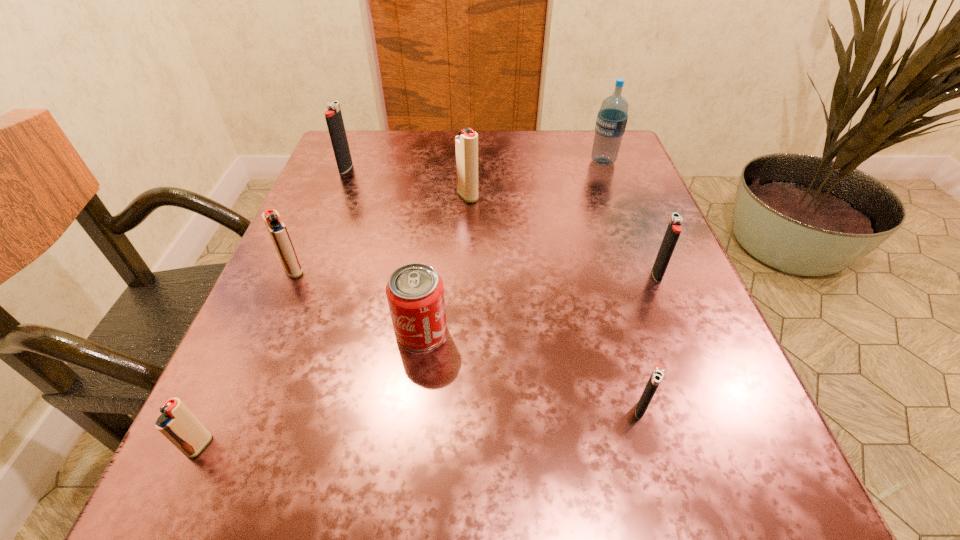
Identify the location of unoccupied position between the water bottle and the second nearest black igniter. 630,218.

What are the coordinates of `free spot between the fourth object from left to right and the second nearest object` in the screenshot? It's located at (531, 370).

Find the location of a particular element. The image size is (960, 540). free spot between the smallest red igniter and the farthest igniter is located at coordinates (273, 307).

Where is `vacant region between the second biggest black igniter and the tallest object`? The width and height of the screenshot is (960, 540). vacant region between the second biggest black igniter and the tallest object is located at coordinates (630, 218).

This screenshot has width=960, height=540. What are the coordinates of `empty location between the blue water bottle and the seventh farthest object` in the screenshot? It's located at (622, 285).

Image resolution: width=960 pixels, height=540 pixels. In order to click on free space between the smallest black igniter and the second nearest red igniter in this screenshot , I will do `click(468, 340)`.

Identify which object is the closest to the leftmost black igniter. Please provide its 2D coordinates. Your answer should be formatted as a tuple, i.e. [(x, y)], where the tuple contains the x and y coordinates of a point satisfying the conditions above.

[(466, 143)]

This screenshot has width=960, height=540. I want to click on object that is the closest to the sixth farthest object, so click(276, 228).

Where is `igniter that is the third closest to the leftmost black igniter`? igniter that is the third closest to the leftmost black igniter is located at coordinates (177, 423).

Identify which igniter is the closest to the second nearest red igniter. Please provide its 2D coordinates. Your answer should be formatted as a tuple, i.e. [(x, y)], where the tuple contains the x and y coordinates of a point satisfying the conditions above.

[(177, 423)]